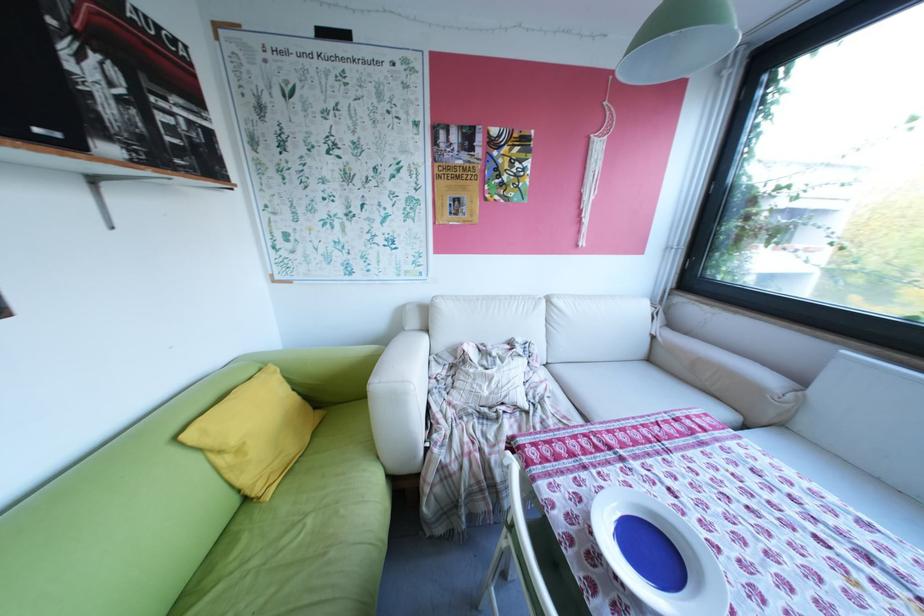
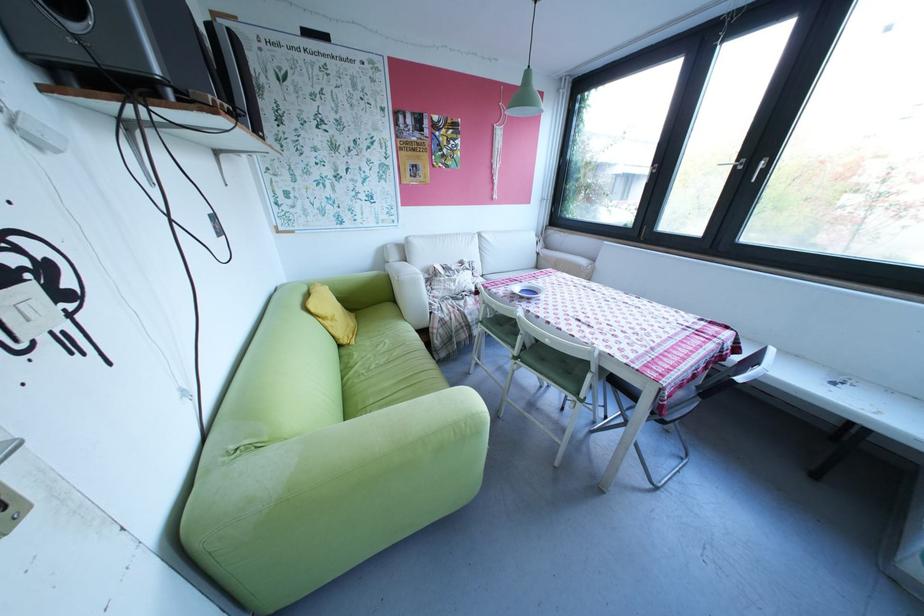
In the second image, find the point that corresponds to point 517,177 in the first image.

(457, 151)